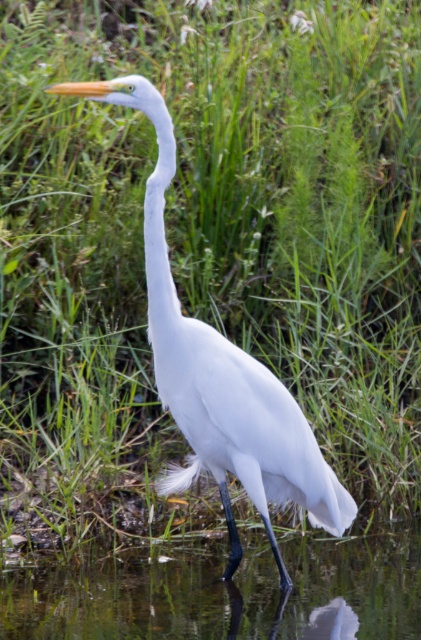
Describe the element at coordinates (226, 595) in the screenshot. I see `clear water at lower center` at that location.

Does clear water at lower center appear under white feathered bird at center?

Correct, clear water at lower center is located below white feathered bird at center.

Between point (170, 634) and point (156, 234), which one is positioned in front?

Point (156, 234)

Identify the location of clear water at lower center. (226, 595).

In the scene shown: Which is more to the left, clear water at lower center or white matte neck at center?

Positioned to the left is white matte neck at center.

At what (x,y) coordinates should I click in order to perform the action: click on clear water at lower center. Please return your answer as a coordinate pair (x, y). This screenshot has height=640, width=421. Looking at the image, I should click on (226, 595).

Can you confirm if white feathered bird at center is positioned to the left of white matte neck at center?

In fact, white feathered bird at center is to the right of white matte neck at center.

Is point (173, 353) positioned before point (146, 209)?

No, it is behind (146, 209).

Find the location of a particular element. Image resolution: width=421 pixels, height=640 pixels. white feathered bird at center is located at coordinates (220, 374).